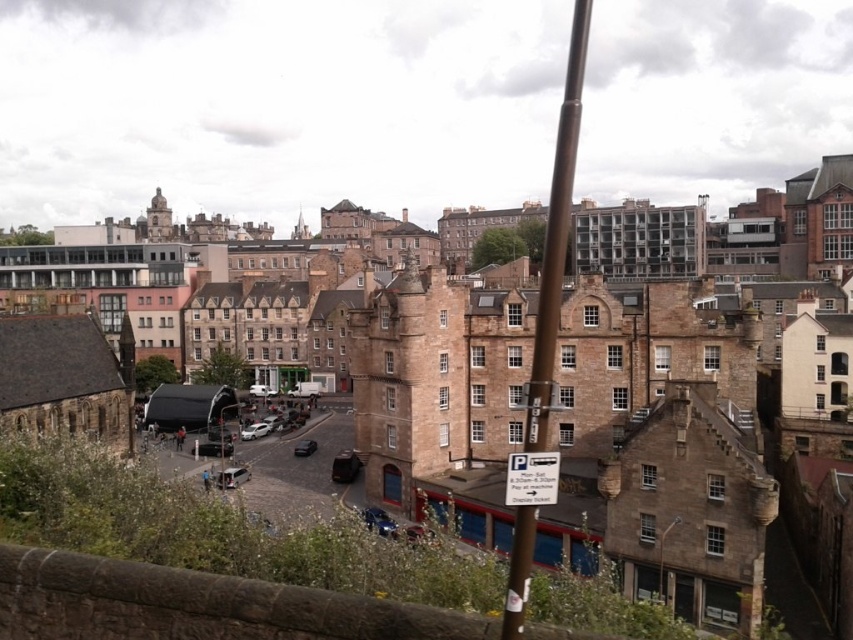
Between brown metallic pole at center and white plastic parking sign at lower center, which one appears on the left side from the viewer's perspective?

Positioned to the left is white plastic parking sign at lower center.

Is brown metallic pole at center below white plastic parking sign at lower center?

Actually, brown metallic pole at center is above white plastic parking sign at lower center.

Based on the photo, who is more distant from viewer, (573,96) or (521,472)?

Point (573,96)

Where is `brown metallic pole at center`? Image resolution: width=853 pixels, height=640 pixels. brown metallic pole at center is located at coordinates (556, 236).

Which is behind, point (543, 468) or point (250, 426)?

The point (250, 426) is behind.

Locate an element on the screen. This screenshot has width=853, height=640. white plastic parking sign at lower center is located at coordinates (532, 477).

Is white plastic parking sign at lower center above shiny black car at center?

Yes.

At what (x,y) coordinates should I click in order to perform the action: click on white plastic parking sign at lower center. Please return your answer as a coordinate pair (x, y). Looking at the image, I should click on (532, 477).

Which is in front, point (514, 477) or point (296, 449)?

Point (514, 477) is in front.

You are a GUI agent. You are given a task and a screenshot of the screen. Output one action in this format:
    pyautogui.click(x=<x>, y=<y>)
    Task: Click on the white plastic parking sign at lower center
    This screenshot has width=853, height=640.
    Given the screenshot: What is the action you would take?
    pyautogui.click(x=532, y=477)